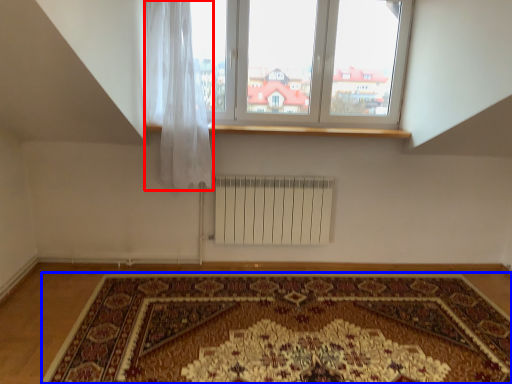
Question: Which object appears closest to the camera in this image, curtain (highlighted by a red box) or mat (highlighted by a blue box)?

Choices:
 (A) curtain
 (B) mat

Answer: (B)